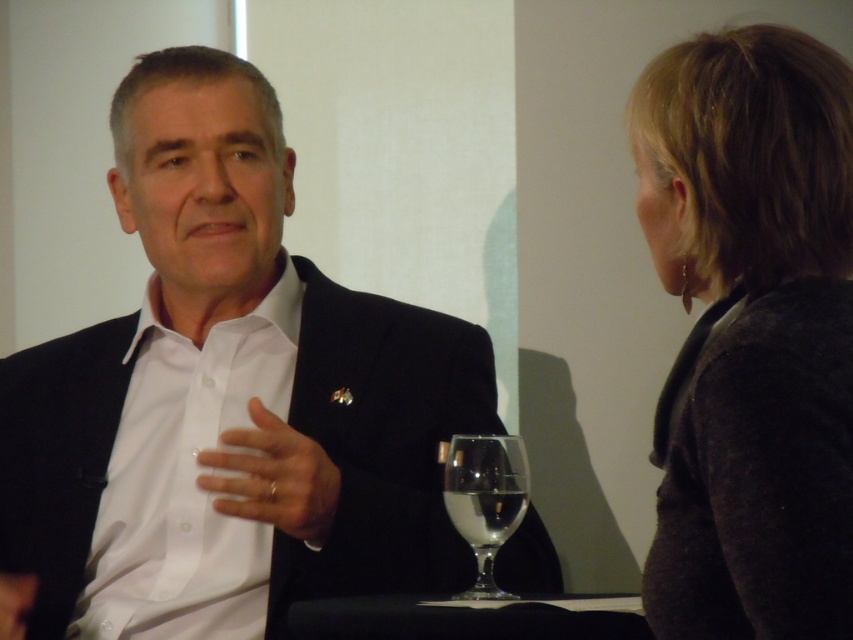
You are a server in a restaurant and need to place a new wine glass on the table between the dark gray sweater at upper right and the clear glass wine at center. The new glass has a diameter of 4 inches. Is there enough space between them to fit the new glass?

The distance between the dark gray sweater at upper right and the clear glass wine at center is 20.93 inches. Since the new glass only requires 4 inches of space, there is sufficient room to place it between them.

You are a waiter standing behind the table. You need to place a new wine glass exactly where the clear glass wine glass at center was. Where should you place it?

You should place the new wine glass exactly at point [485,499] where the clear glass wine glass at center was located.

In the scene shown: You are a waiter at a restaurant and need to place a dessert plate between the clear glass wine glass at center and the clear glass wine at center. Which object should you move to make space?

The clear glass wine at center has a smaller width than the clear glass wine glass at center. To make space, move the clear glass wine at center since it is narrower and easier to shift aside.